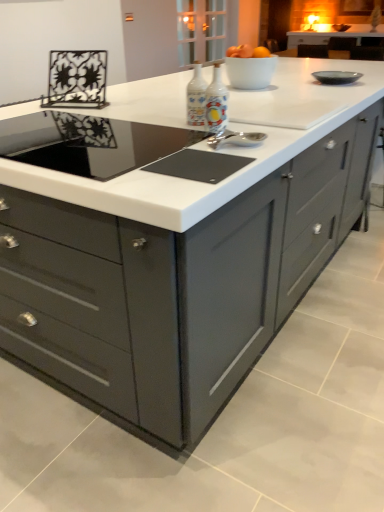
Question: Is porcelain bottles at center, positioned as the first appliance in right-to-left order, to the right of black glass cooktop at center from the viewer's perspective?

Choices:
 (A) no
 (B) yes

Answer: (B)

Question: Is porcelain bottles at center, which is the second appliance from left to right, positioned behind black glass cooktop at center?

Choices:
 (A) yes
 (B) no

Answer: (A)

Question: Can you confirm if porcelain bottles at center, which is the second appliance from left to right, is smaller than black glass cooktop at center?

Choices:
 (A) no
 (B) yes

Answer: (B)

Question: Is porcelain bottles at center, which is the second appliance from left to right, looking in the opposite direction of black glass cooktop at center?

Choices:
 (A) yes
 (B) no

Answer: (B)

Question: Does porcelain bottles at center, which is the second appliance from left to right, appear on the left side of black glass cooktop at center?

Choices:
 (A) no
 (B) yes

Answer: (A)

Question: Does point (59, 167) appear closer or farther from the camera than point (365, 187)?

Choices:
 (A) farther
 (B) closer

Answer: (B)

Question: In the image, is black glass cooktop at center positioned in front of or behind matte gray cabinet at right?

Choices:
 (A) behind
 (B) front

Answer: (B)

Question: From the image's perspective, relative to matte gray cabinet at right, is black glass cooktop at center above or below?

Choices:
 (A) below
 (B) above

Answer: (A)

Question: From their relative heights in the image, would you say black glass cooktop at center is taller or shorter than matte gray cabinet at right?

Choices:
 (A) tall
 (B) short

Answer: (B)

Question: From their relative heights in the image, would you say matte gray cabinet at right is taller or shorter than matte glass bottles at center, the 2th appliance when ordered from right to left?

Choices:
 (A) tall
 (B) short

Answer: (A)

Question: In the image, is matte gray cabinet at right positioned in front of or behind matte glass bottles at center, the 2th appliance when ordered from right to left?

Choices:
 (A) behind
 (B) front

Answer: (A)

Question: Is point pos(340,221) positioned closer to the camera than point pos(198,120)?

Choices:
 (A) farther
 (B) closer

Answer: (A)

Question: Visually, is matte gray cabinet at right positioned to the left or to the right of matte glass bottles at center, the 2th appliance when ordered from right to left?

Choices:
 (A) left
 (B) right

Answer: (B)

Question: Do you think matte glass bottles at center, positioned as the first appliance in left-to-right order, is within black glass cooktop at center, or outside of it?

Choices:
 (A) outside
 (B) inside

Answer: (A)

Question: Is point (193, 79) closer or farther from the camera than point (119, 156)?

Choices:
 (A) closer
 (B) farther

Answer: (B)